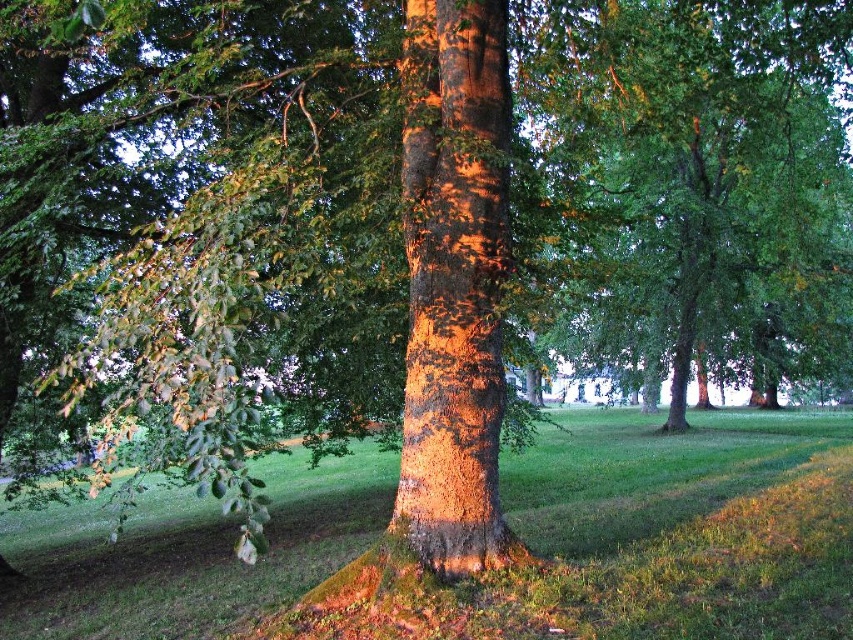
Question: Which of the following is the farthest from the observer?

Choices:
 (A) (805, 161)
 (B) (450, 48)
 (C) (76, 550)

Answer: (A)

Question: Does green leafy tree at center have a lesser width compared to shiny brown bark at center?

Choices:
 (A) yes
 (B) no

Answer: (B)

Question: Does green grassy at center appear under green leafy tree at center?

Choices:
 (A) yes
 (B) no

Answer: (A)

Question: In this image, where is green leafy tree at center located relative to shiny brown bark at center?

Choices:
 (A) left
 (B) right

Answer: (B)

Question: Which point is closer to the camera taking this photo?

Choices:
 (A) (595, 70)
 (B) (717, 420)

Answer: (A)

Question: Which of the following is the closest to the observer?

Choices:
 (A) green grassy at center
 (B) green leafy tree at center

Answer: (A)